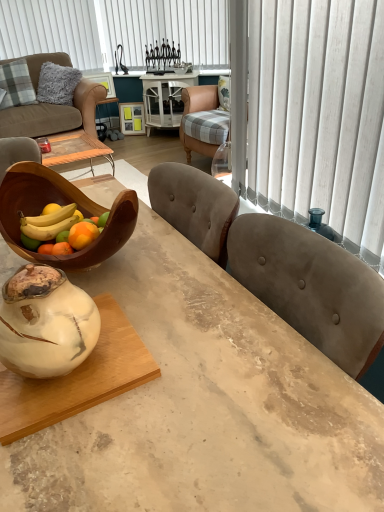
The image size is (384, 512). I want to click on vacant area that lies to the right of wooden bowl at left, so click(x=184, y=267).